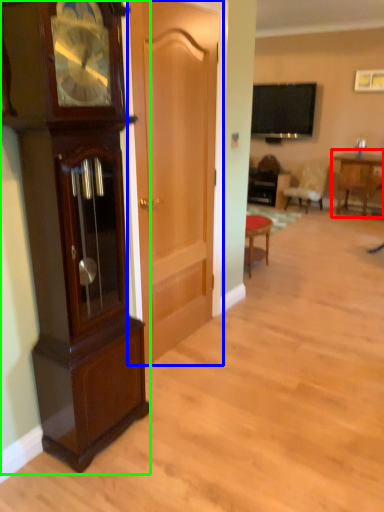
Question: Which object is positioned closest to table (highlighted by a red box)? Select from door (highlighted by a blue box) and cabinetry (highlighted by a green box).

Choices:
 (A) door
 (B) cabinetry

Answer: (A)